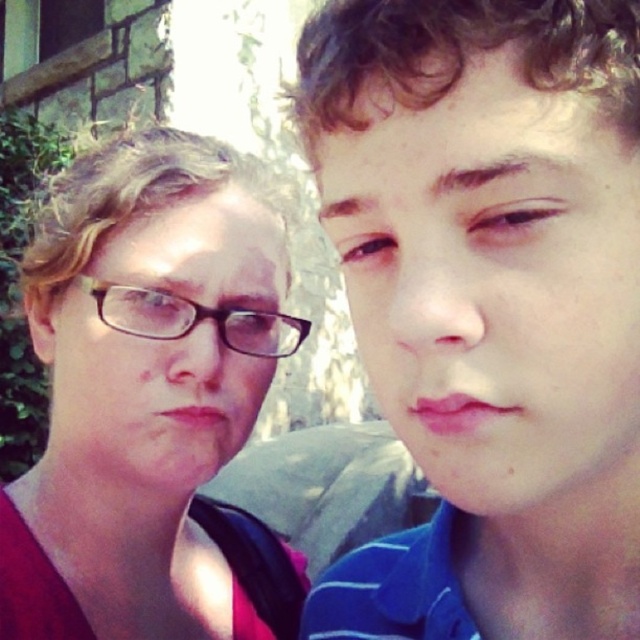
You are a photographer trying to capture a closeup of the person on the left. You notice two pairs of glasses in the scene. Which pair of glasses is taller between the matte black glasses at left and the black plastic glasses at upper left?

The matte black glasses at left is taller than the black plastic glasses at upper left according to the description.